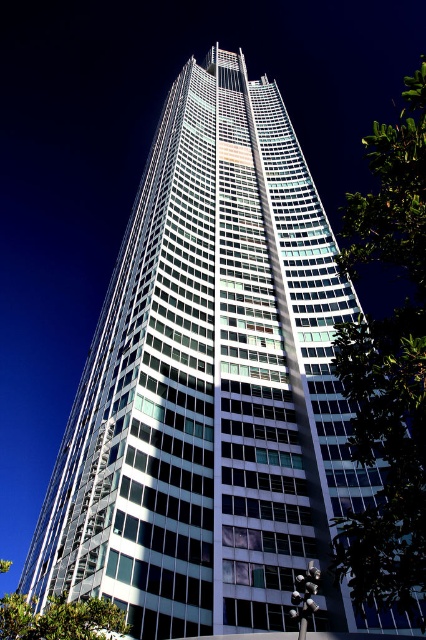
Between green leafy tree at right and green leafy tree at lower left, which one is positioned higher?

green leafy tree at right

Based on the photo, is green leafy tree at right shorter than green leafy tree at lower left?

Incorrect, green leafy tree at right's height does not fall short of green leafy tree at lower left's.

Does point (408, 566) lie in front of point (74, 605)?

Yes, point (408, 566) is in front of point (74, 605).

At what (x,y) coordinates should I click in order to perform the action: click on green leafy tree at right. Please return your answer as a coordinate pair (x, y). Image resolution: width=426 pixels, height=640 pixels. Looking at the image, I should click on (388, 371).